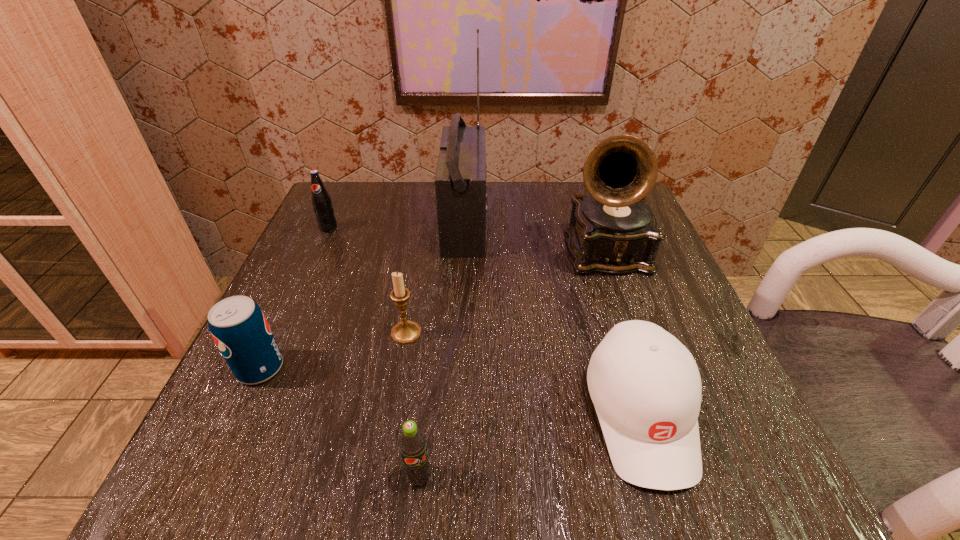
The width and height of the screenshot is (960, 540). What are the coordinates of `the tallest object` in the screenshot? It's located at (460, 182).

At what (x,y) coordinates should I click in order to perform the action: click on phonograph record. Please return your answer as a coordinate pair (x, y). Looking at the image, I should click on (614, 231).

The image size is (960, 540). Find the location of `the farthest soda`. the farthest soda is located at coordinates (322, 204).

Find the location of `the third object from left to right`. the third object from left to right is located at coordinates (405, 332).

Where is `candle holder`? The height and width of the screenshot is (540, 960). candle holder is located at coordinates (405, 332).

The height and width of the screenshot is (540, 960). I want to click on the second farthest soda, so click(x=237, y=324).

Locate an element on the screen. Image resolution: width=960 pixels, height=540 pixels. the rightmost soda is located at coordinates (412, 443).

Locate an element on the screen. The image size is (960, 540). baseball cap is located at coordinates (645, 385).

This screenshot has width=960, height=540. Find the location of `vacant area situated on the front panel of the tallest object`. vacant area situated on the front panel of the tallest object is located at coordinates (594, 224).

This screenshot has height=540, width=960. I want to click on vacant space situated 0.310m on the horn of the phonograph record, so click(x=672, y=445).